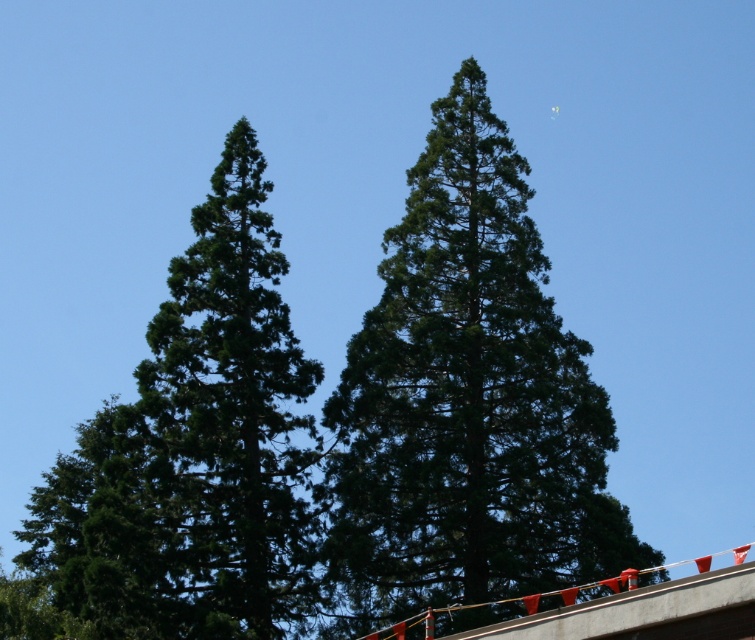
You are standing at the center of the image and want to place a new orange traffic cone exactly where the green textured tree at center is located. Is this possible given the current setup?

The green textured tree at center is located at point (467, 401), so placing a new orange traffic cone there would not be possible as the tree is already occupying that space.